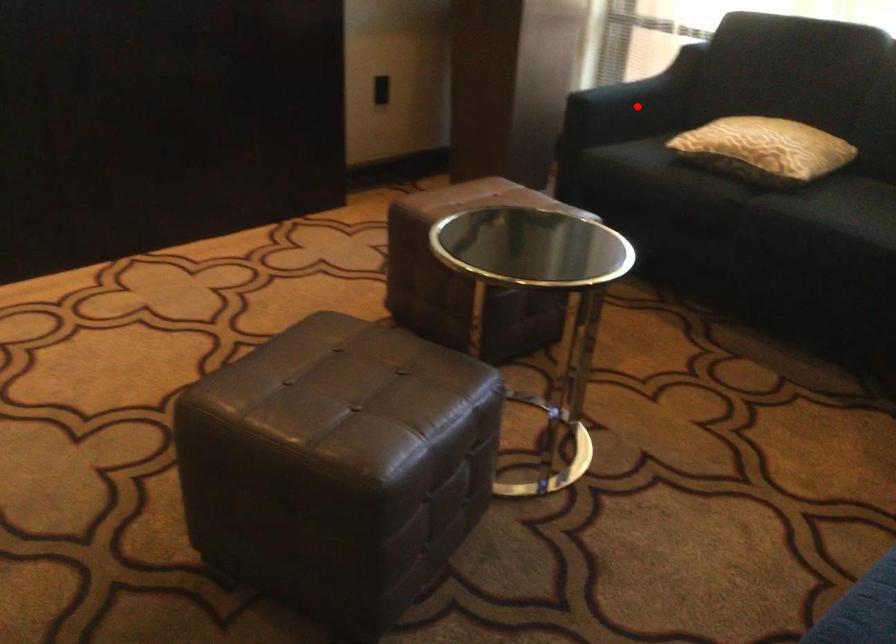
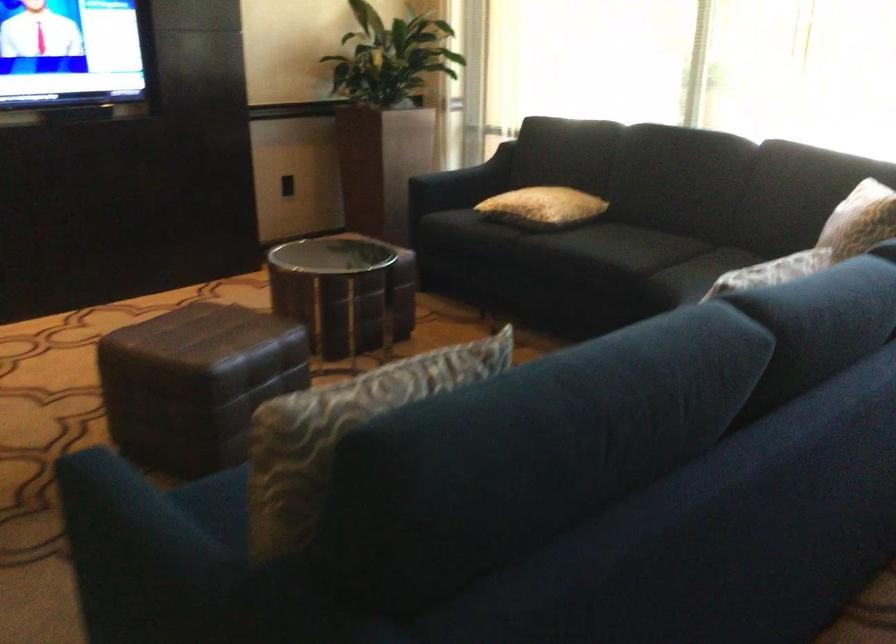
Question: I am providing you with two images of the same scene from different viewpoints. A red point is shown in image1. For the corresponding object point in image2, is it positioned nearer or farther from the camera?

Choices:
 (A) Nearer
 (B) Farther

Answer: (B)